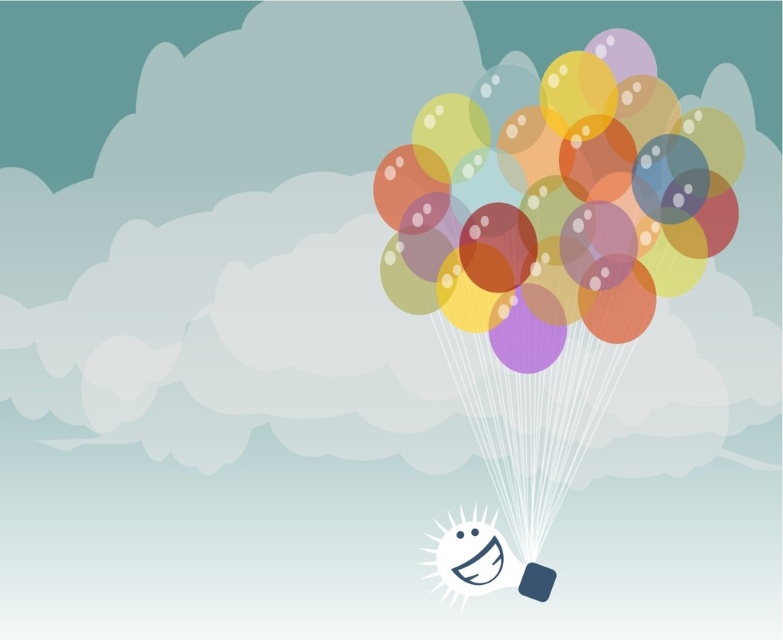
You are an observer looking at the image. The scene has a gradient sky and a smiling face holding balloons. Which object is bigger between the translucent paper balloons at upper center and the smooth blue square at lower right?

The translucent paper balloons at upper center is larger compared to the smooth blue square at lower right.

You are an observer looking at the image. There is a translucent paper balloons at upper center and a smooth blue square at lower right. Which object is closer to you?

The translucent paper balloons at upper center is closer to you because the smooth blue square at lower right is behind it.

You are standing in front of the scene with the balloons and the smiling face. There are two points marked in the image. The first point is at coordinates point (520,342) and the second is at point (503,572). Which point is closer to you?

Point (520,342) is further to the camera than point (503,572), so the second point is closer to you.